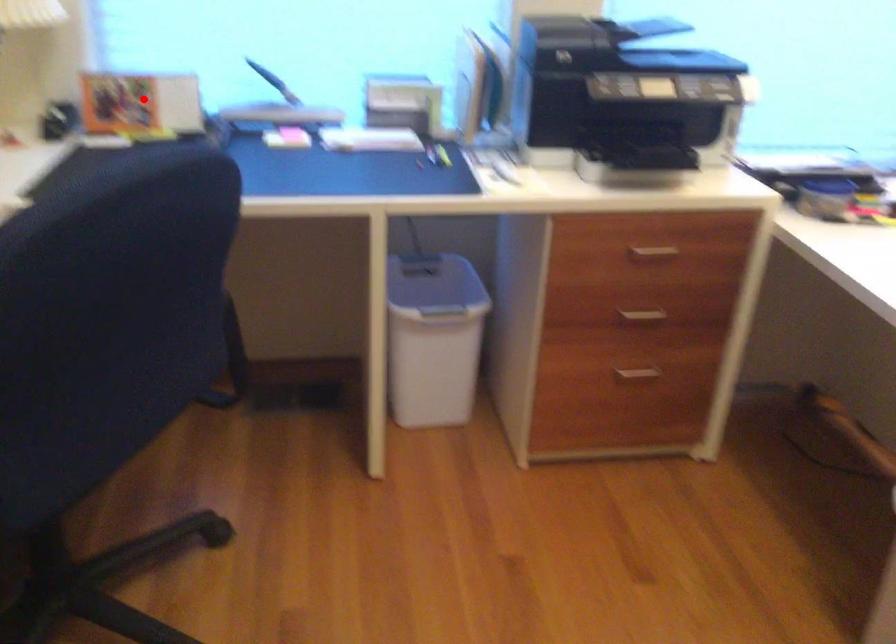
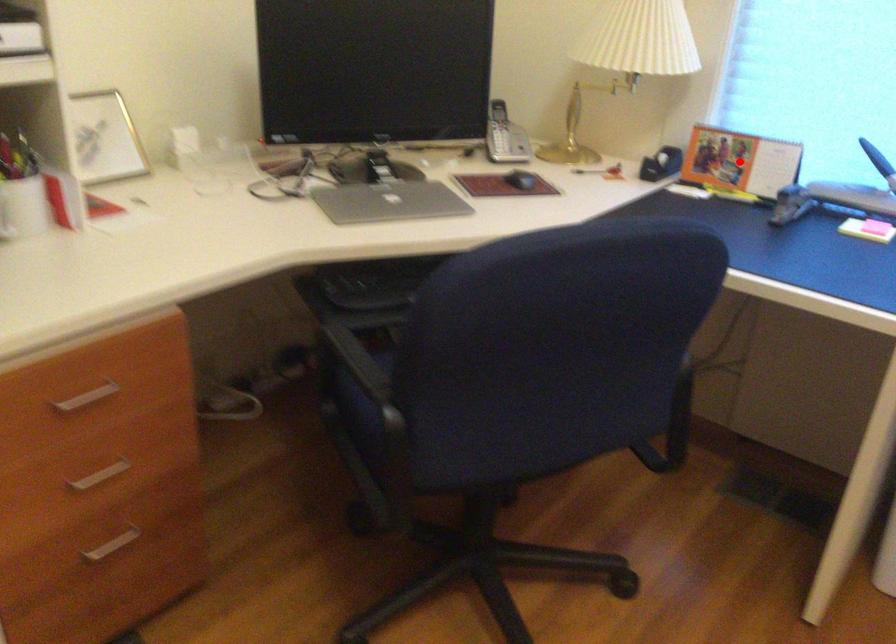
I am providing you with two images of the same scene from different viewpoints. A red point is marked on the first image and another point is marked on the second image. Does the point marked in image1 correspond to the same location as the one in image2?

Yes